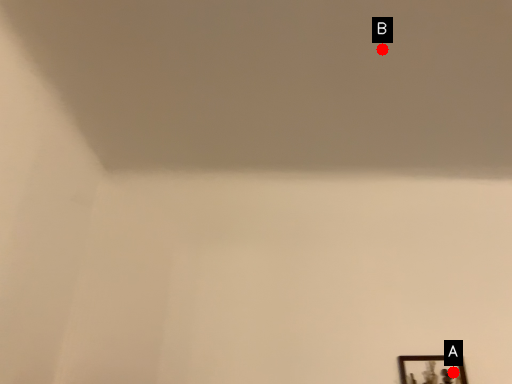
Question: Two points are circled on the image, labeled by A and B beside each circle. Which of the following is the closest to the observer?

Choices:
 (A) A is closer
 (B) B is closer

Answer: (B)